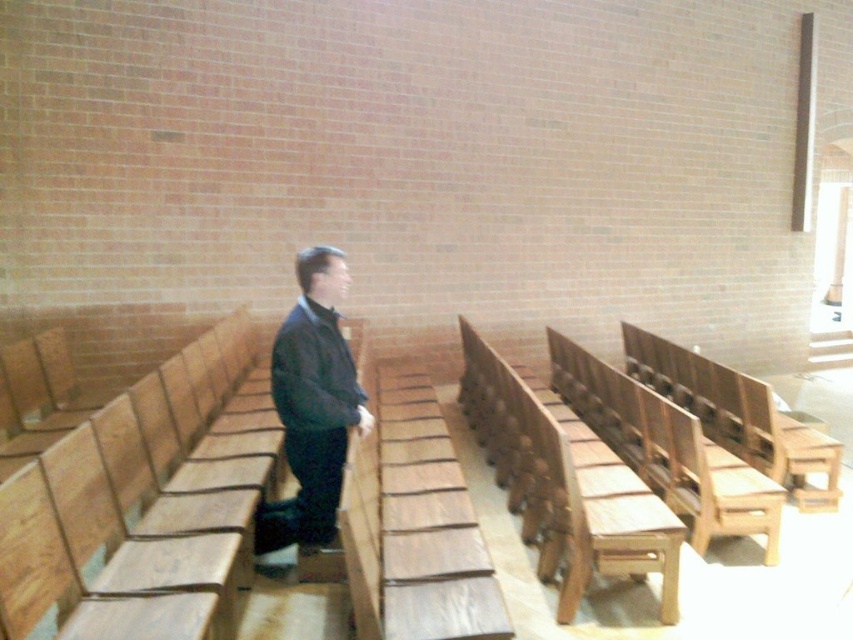
You are a visitor entering the church and need to sit down. You see a wooden bench at center and a dark blue jacket at center. Which object is shorter in height?

The wooden bench at center is not as tall as the dark blue jacket at center, so the wooden bench at center is shorter in height.

You are standing in a church and see a wooden bench at center and a dark blue jacket at center. Which object is located to the right of the other?

The wooden bench at center is positioned on the right side of dark blue jacket at center.

In the scene shown: You are planning to sit on the wooden bench at center while wearing your dark blue jacket at center. Can your jacket fit on the bench without any part hanging off the sides?

The wooden bench at center is wider than the dark blue jacket at center, so the jacket can fit on the bench without any part hanging off the sides.